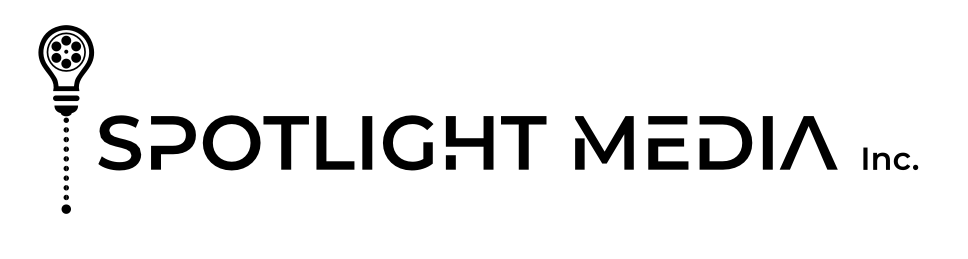
Identify the location of for turning lightbulb on and off. (65, 177).